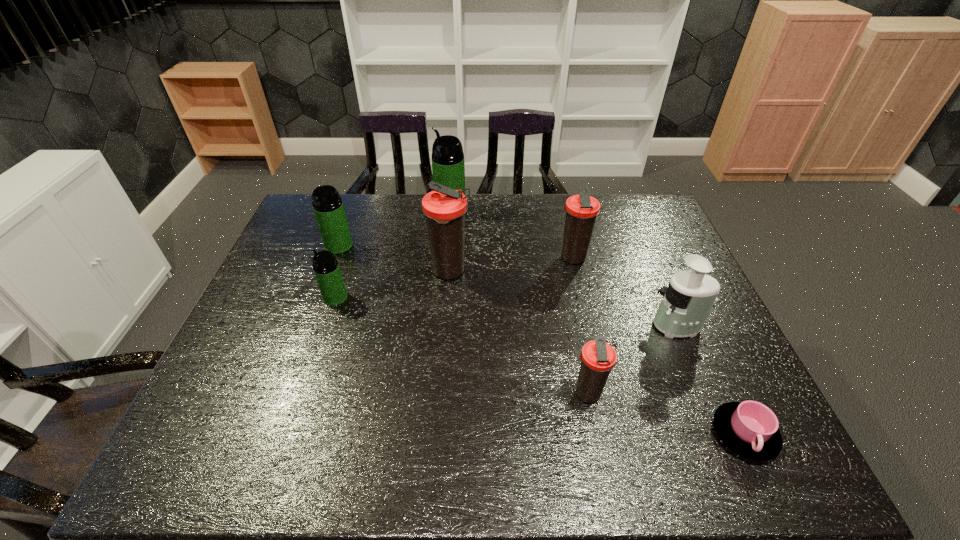
At what (x,y) coordinates should I click in order to perform the action: click on vacant position at the near edge of the desktop. Please return your answer as a coordinate pair (x, y). This screenshot has width=960, height=540. Looking at the image, I should click on (493, 434).

In the image, there is a desktop. Where is `vacant area at the left edge`? This screenshot has width=960, height=540. vacant area at the left edge is located at coordinates (210, 389).

I want to click on vacant region at the far left corner of the desktop, so click(x=317, y=234).

The width and height of the screenshot is (960, 540). I want to click on vacant region at the far right corner of the desktop, so click(628, 197).

This screenshot has width=960, height=540. In the image, there is a desktop. Identify the location of free region at the near right corner. (797, 475).

Where is `free area in between the pink cup and the juicer`? free area in between the pink cup and the juicer is located at coordinates (711, 380).

In order to click on vacant space in between the second smallest green thermos bottle and the cup in this screenshot , I will do `click(541, 340)`.

Identify the location of vacant point located between the leftmost brown thermos bottle and the smallest green thermos bottle. The width and height of the screenshot is (960, 540). (393, 285).

Image resolution: width=960 pixels, height=540 pixels. What are the coordinates of `free area in between the second smallest brown thermos bottle and the sixth farthest object` in the screenshot? It's located at (625, 292).

Locate an element on the screen. unoccupied area between the biggest brown thermos bottle and the second biggest brown thermos bottle is located at coordinates (511, 265).